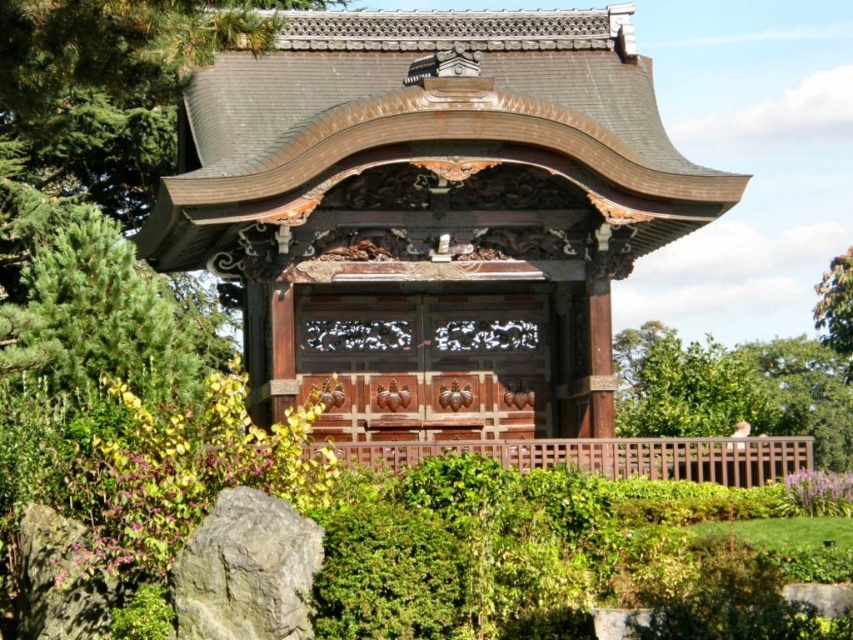
Question: Which of the following is the closest to the observer?

Choices:
 (A) (640, 88)
 (B) (223, 525)

Answer: (B)

Question: Observing the image, what is the correct spatial positioning of polished wood gazebo at center in reference to gray rough rock at lower left?

Choices:
 (A) left
 (B) right

Answer: (B)

Question: Is polished wood gazebo at center positioned in front of gray rough rock at lower left?

Choices:
 (A) no
 (B) yes

Answer: (A)

Question: Is polished wood gazebo at center positioned before gray rough rock at lower left?

Choices:
 (A) no
 (B) yes

Answer: (A)